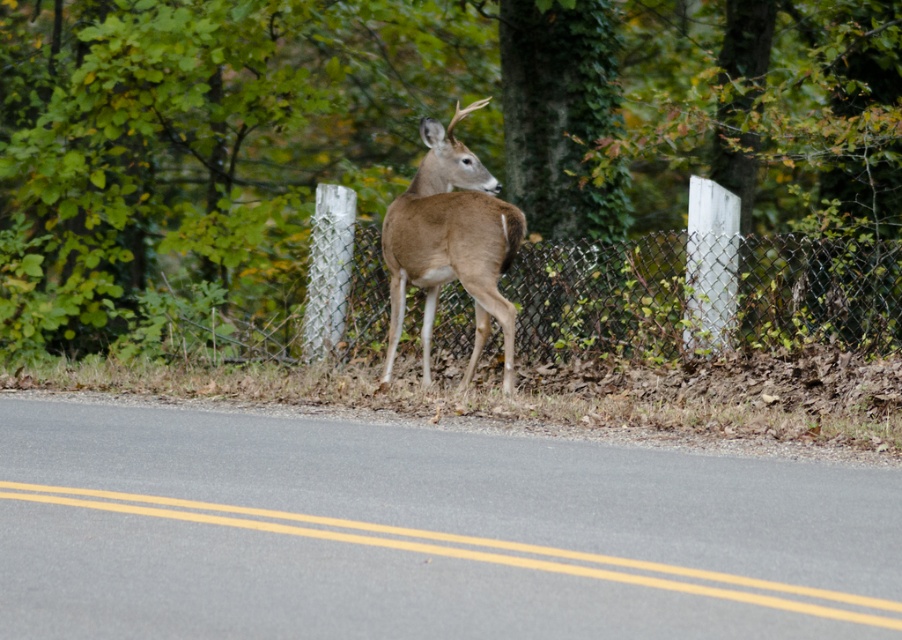
Is metallic chain-link fence at center further to camera compared to brown matte deer at center?

Yes.

Is metallic chain-link fence at center below brown matte deer at center?

Yes.

Between point (336, 266) and point (483, 314), which one is positioned behind?

Positioned behind is point (336, 266).

This screenshot has width=902, height=640. Identify the location of metallic chain-link fence at center. (703, 292).